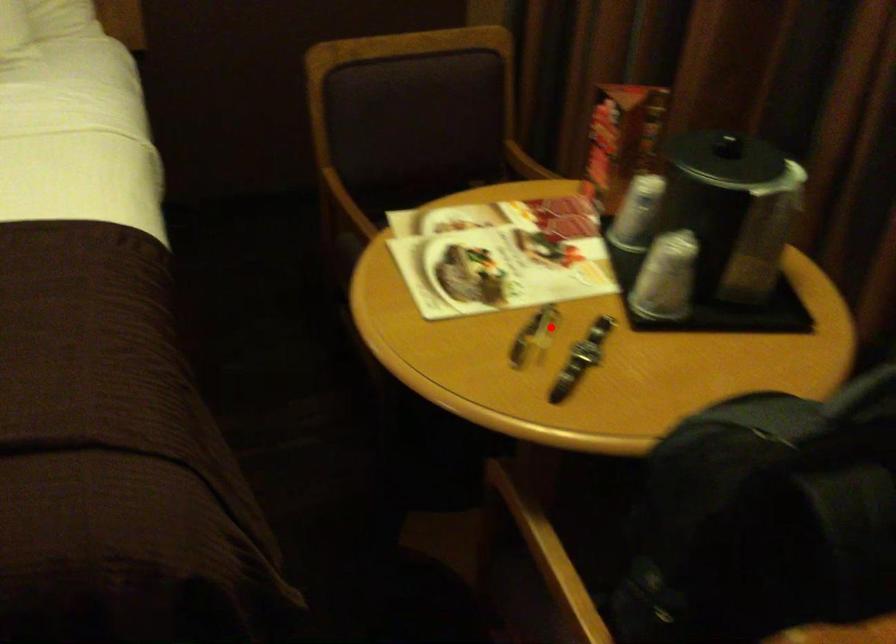
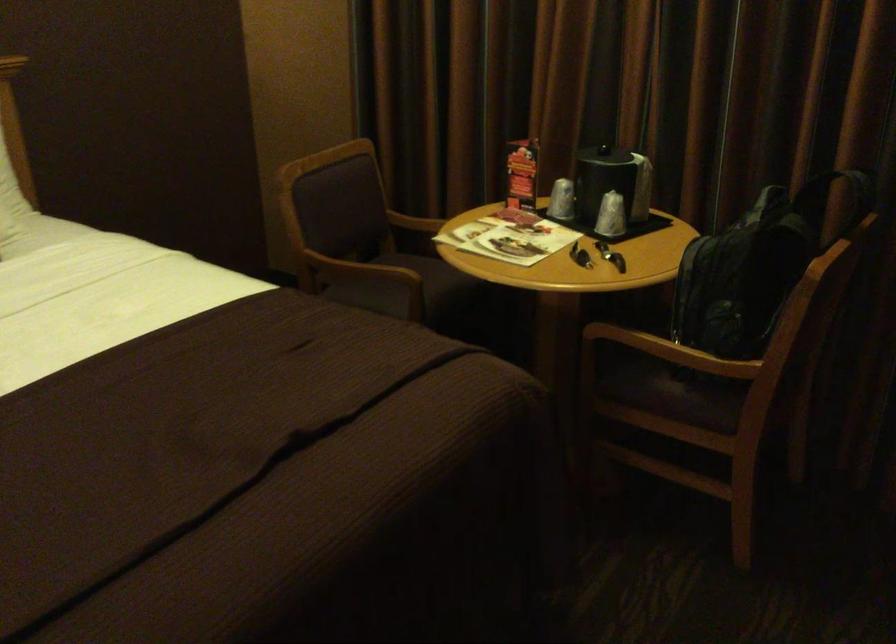
Question: I am providing you with two images of the same scene from different viewpoints. Given a red point in image1, look at the same physical point in image2. Is it:

Choices:
 (A) Closer to the viewpoint
 (B) Farther from the viewpoint

Answer: (B)